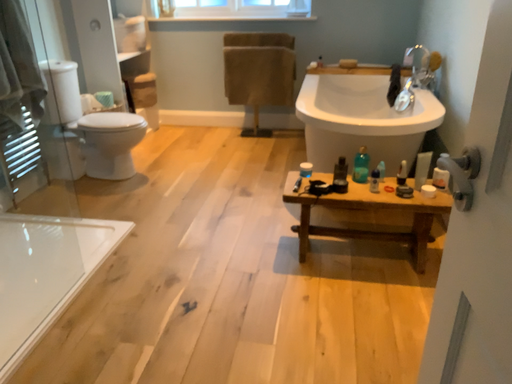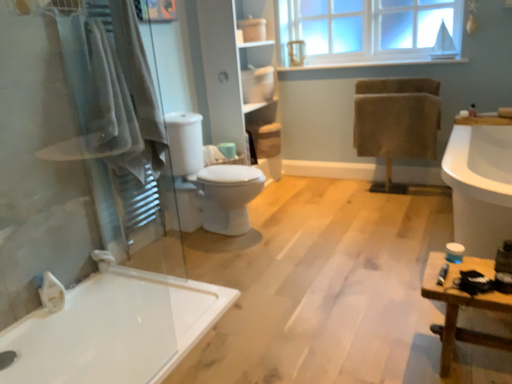
Question: Which way did the camera rotate in the video?

Choices:
 (A) rotated right
 (B) rotated left

Answer: (B)